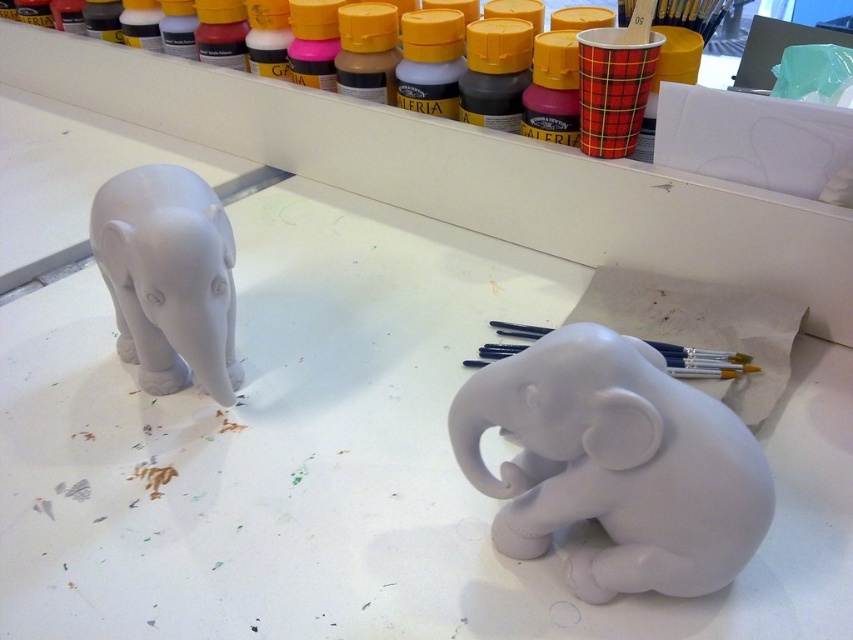
Does white matte elephant at lower right appear on the left side of white matte elephant at left?

No, white matte elephant at lower right is not to the left of white matte elephant at left.

Where is `white matte elephant at lower right`? white matte elephant at lower right is located at coordinates (614, 465).

The image size is (853, 640). What are the coordinates of `white matte elephant at lower right` in the screenshot? It's located at (614, 465).